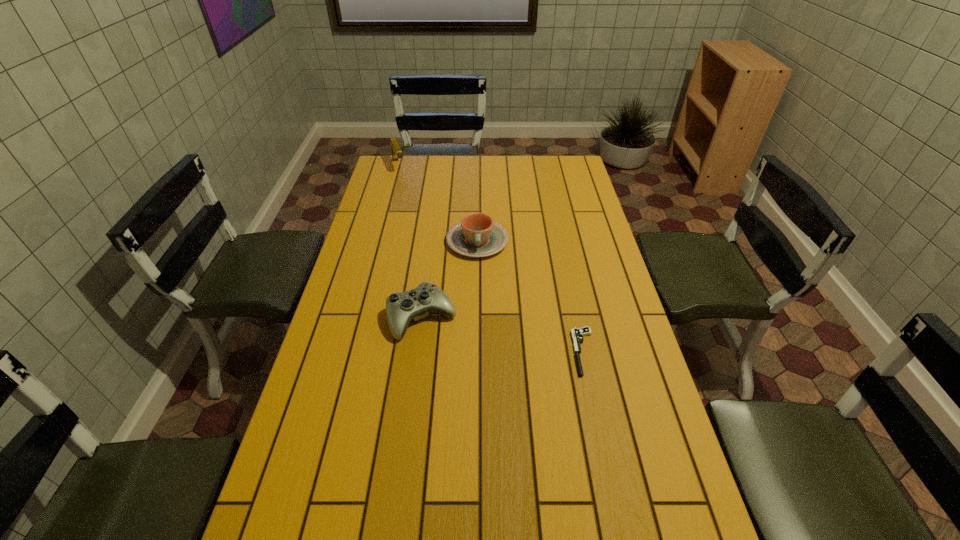
The height and width of the screenshot is (540, 960). I want to click on vacant space located on the handle side of the chinaware, so click(x=480, y=328).

Locate an element on the screen. The height and width of the screenshot is (540, 960). blank area located 0.190m at the barrel of the farther pistol is located at coordinates (410, 196).

Identify the location of blank area located at the barrel of the farther pistol. The width and height of the screenshot is (960, 540). (403, 181).

Locate an element on the screen. This screenshot has width=960, height=540. vacant space located 0.100m at the barrel of the farther pistol is located at coordinates (404, 185).

This screenshot has width=960, height=540. What are the coordinates of `object that is positioned at the far edge` in the screenshot? It's located at (396, 151).

This screenshot has width=960, height=540. I want to click on object that is positioned at the left edge, so click(x=396, y=151).

Where is `object located in the right edge section of the desktop`? The height and width of the screenshot is (540, 960). object located in the right edge section of the desktop is located at coordinates (577, 334).

Locate an element on the screen. Image resolution: width=960 pixels, height=540 pixels. object present at the far left corner is located at coordinates (396, 151).

Image resolution: width=960 pixels, height=540 pixels. Identify the location of blank area at the far edge. (521, 158).

Find the location of a particular element. free region at the near edge of the desktop is located at coordinates pos(534,526).